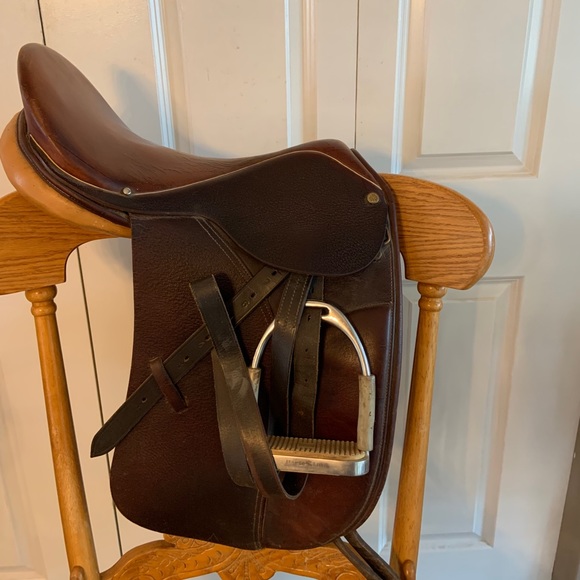
Locate an element on the screen. The image size is (580, 580). wood grain is located at coordinates 438,245, 19,244.